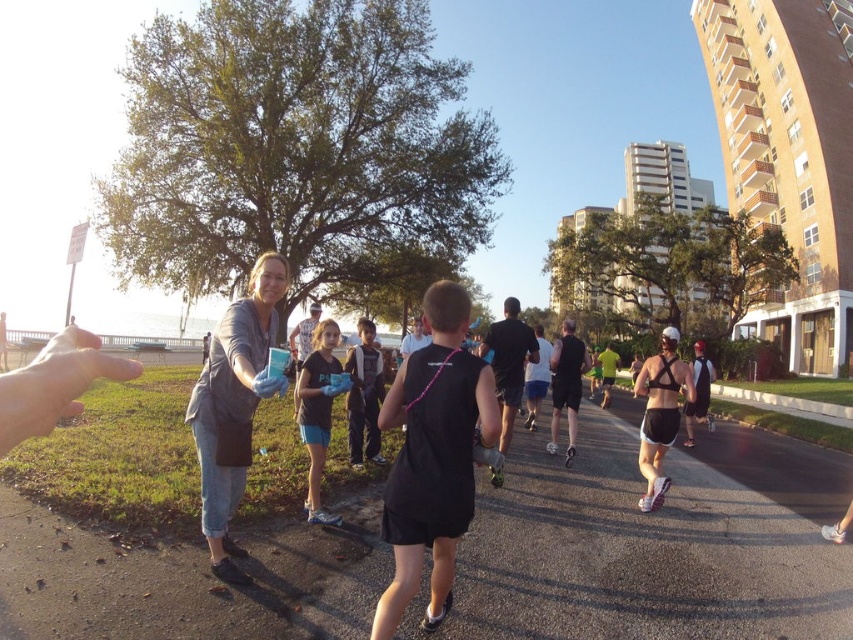
You are a photographer trying to focus on the black matte tank top at center. What are the coordinates where you should adjust your camera focus to capture it precisely?

The black matte tank top at center should be focused at the coordinates point (433, 456) to capture it precisely.